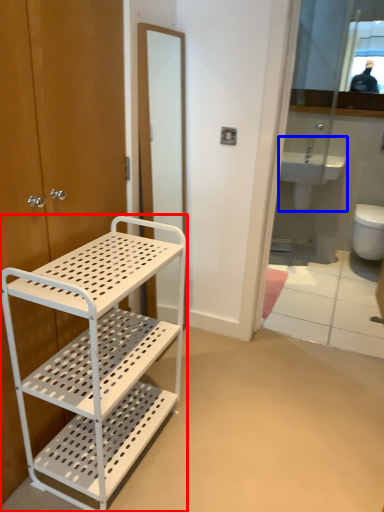
Question: Which point is closer to the camera, bathroom cabinet (highlighted by a red box) or sink (highlighted by a blue box)?

Choices:
 (A) bathroom cabinet
 (B) sink

Answer: (A)